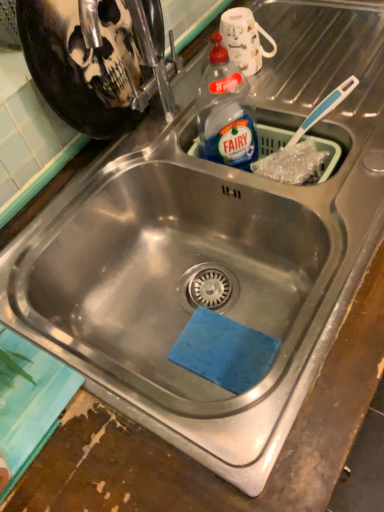
You are a GUI agent. You are given a task and a screenshot of the screen. Output one action in this format:
    pyautogui.click(x=<x>, y=<y>)
    Task: Click on the free spot in front of white glossy mug at upper center
    The height and width of the screenshot is (512, 384).
    Given the screenshot: What is the action you would take?
    pyautogui.click(x=264, y=122)